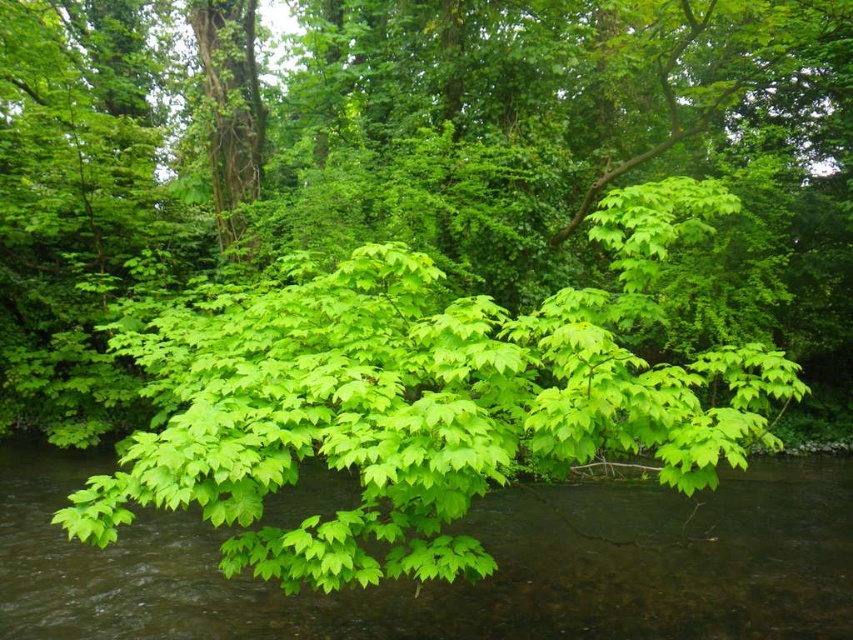
Which is more to the left, green matte leaf at center or green leafy branches at center?

green matte leaf at center is more to the left.

Between point (263, 352) and point (502, 536), which one is positioned in front?

Positioned in front is point (263, 352).

The image size is (853, 640). Find the location of `green matte leaf at center`. green matte leaf at center is located at coordinates (422, 401).

Who is more distant from viewer, (786, 330) or (212, 524)?

Point (786, 330)

Identify the location of green leafy tree at center. (415, 163).

Which is above, green leafy tree at center or green leafy branches at center?

green leafy tree at center is above.

Who is more forward, [759,26] or [838,611]?

Point [838,611] is more forward.

You are a GUI agent. You are given a task and a screenshot of the screen. Output one action in this format:
    pyautogui.click(x=<x>, y=<y>)
    Task: Click on the green leafy tree at center
    
    Given the screenshot: What is the action you would take?
    pyautogui.click(x=415, y=163)